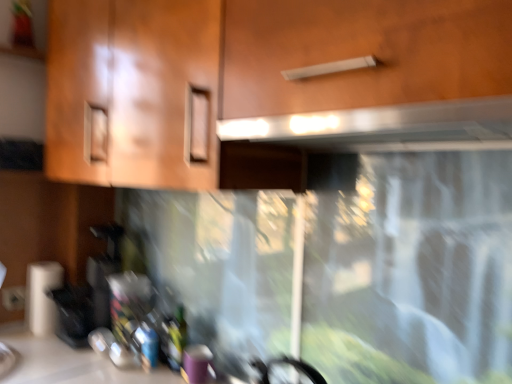
Question: Is white plastic electric outlet at lower left at the right side of matte wood cabinet at upper center?

Choices:
 (A) yes
 (B) no

Answer: (B)

Question: From a real-world perspective, does white plastic electric outlet at lower left stand above matte wood cabinet at upper center?

Choices:
 (A) no
 (B) yes

Answer: (A)

Question: Can you confirm if white plastic electric outlet at lower left is shorter than matte wood cabinet at upper center?

Choices:
 (A) no
 (B) yes

Answer: (B)

Question: Considering the relative sizes of white plastic electric outlet at lower left and matte wood cabinet at upper center in the image provided, is white plastic electric outlet at lower left thinner than matte wood cabinet at upper center?

Choices:
 (A) no
 (B) yes

Answer: (B)

Question: Can you confirm if white plastic electric outlet at lower left is positioned to the left of matte wood cabinet at upper center?

Choices:
 (A) no
 (B) yes

Answer: (B)

Question: In terms of height, does white matte paper towel at lower left look taller or shorter compared to green glass bottle at lower center?

Choices:
 (A) short
 (B) tall

Answer: (B)

Question: Which is correct: white matte paper towel at lower left is inside green glass bottle at lower center, or outside of it?

Choices:
 (A) outside
 (B) inside

Answer: (A)

Question: From a real-world perspective, relative to green glass bottle at lower center, is white matte paper towel at lower left vertically above or below?

Choices:
 (A) above
 (B) below

Answer: (A)

Question: From the image's perspective, relative to green glass bottle at lower center, is white matte paper towel at lower left above or below?

Choices:
 (A) above
 (B) below

Answer: (A)

Question: In terms of width, does white plastic electric outlet at lower left look wider or thinner when compared to white matte paper towel at lower left?

Choices:
 (A) thin
 (B) wide

Answer: (A)

Question: Looking at the image, does white plastic electric outlet at lower left seem bigger or smaller compared to white matte paper towel at lower left?

Choices:
 (A) big
 (B) small

Answer: (B)

Question: Is white plastic electric outlet at lower left taller or shorter than white matte paper towel at lower left?

Choices:
 (A) tall
 (B) short

Answer: (B)

Question: In the image, is white plastic electric outlet at lower left positioned in front of or behind white matte paper towel at lower left?

Choices:
 (A) front
 (B) behind

Answer: (B)

Question: From the image's perspective, is white matte paper towel at lower left positioned above or below satin silver exhaust hood at upper center?

Choices:
 (A) below
 (B) above

Answer: (A)

Question: In the image, is white matte paper towel at lower left positioned in front of or behind satin silver exhaust hood at upper center?

Choices:
 (A) behind
 (B) front

Answer: (A)